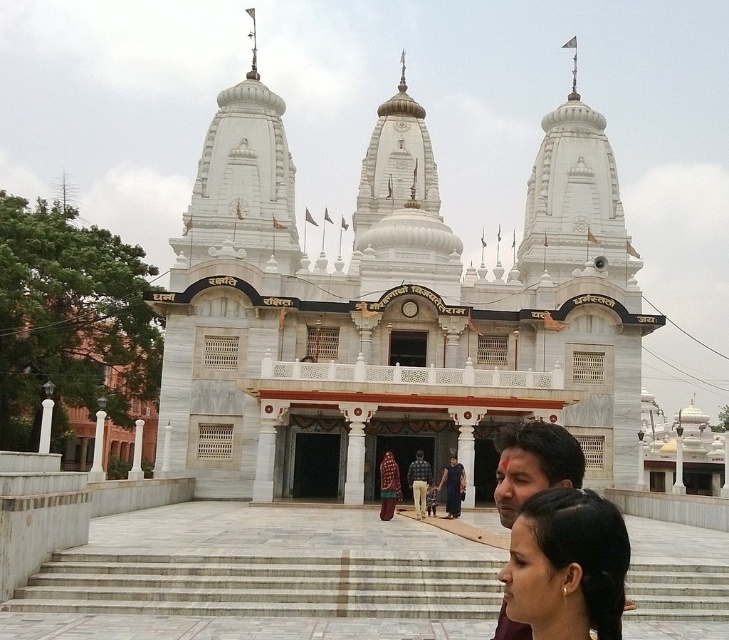
You are standing at the entrance of the temple and see the white marble stairs at center and the brown leather jacket at center. Which object is located to the left when facing the temple?

The white marble stairs at center is positioned on the left side of brown leather jacket at center, so when facing the temple, the white marble stairs at center is to the left of the brown leather jacket at center.

You are a photographer planning to take a portrait of two people wearing the dark brown fabric dress at center and the brown leather jacket at center. You want to ensure the subjects are arranged in the same left to right order as in the image. Which clothing item should be placed to the left?

The dark brown fabric dress at center should be placed to the left since it is positioned on the left side of the brown leather jacket at center in the image.

You are a photographer planning to capture the white marble hindu temple at center and the dark brown fabric dress at center in the same frame. Which object should you focus on first if you want to ensure both are in focus without adjusting the camera settings?

You should focus on the white marble hindu temple at center first because its width surpasses that of the dark brown fabric dress at center, making it larger and requiring a closer focus point.